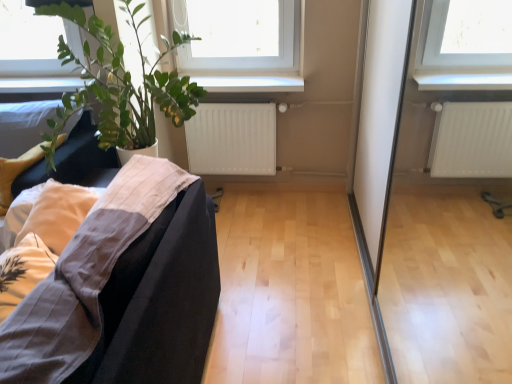
Question: From the image's perspective, does white glossy window sill at upper center appear higher than white matte radiator at center?

Choices:
 (A) yes
 (B) no

Answer: (A)

Question: Is white glossy window sill at upper center to the right of white matte radiator at center from the viewer's perspective?

Choices:
 (A) yes
 (B) no

Answer: (A)

Question: Does white glossy window sill at upper center have a lesser width compared to white matte radiator at center?

Choices:
 (A) no
 (B) yes

Answer: (A)

Question: Are white glossy window sill at upper center and white matte radiator at center beside each other?

Choices:
 (A) yes
 (B) no

Answer: (B)

Question: Is the position of white glossy window sill at upper center less distant than that of white matte radiator at center?

Choices:
 (A) no
 (B) yes

Answer: (B)

Question: Looking at their shapes, would you say transparent glass screen door at lower right is wider or thinner than white matte radiator at center?

Choices:
 (A) thin
 (B) wide

Answer: (A)

Question: Is point (505, 288) positioned closer to the camera than point (230, 163)?

Choices:
 (A) closer
 (B) farther

Answer: (A)

Question: In terms of size, does transparent glass screen door at lower right appear bigger or smaller than white matte radiator at center?

Choices:
 (A) small
 (B) big

Answer: (B)

Question: Considering their positions, is transparent glass screen door at lower right located in front of or behind white matte radiator at center?

Choices:
 (A) behind
 (B) front

Answer: (B)

Question: Is white matte radiator at center situated inside black fabric couch at lower left or outside?

Choices:
 (A) outside
 (B) inside

Answer: (A)

Question: Based on their sizes in the image, would you say white matte radiator at center is bigger or smaller than black fabric couch at lower left?

Choices:
 (A) big
 (B) small

Answer: (B)

Question: Is white matte radiator at center in front of or behind black fabric couch at lower left in the image?

Choices:
 (A) front
 (B) behind

Answer: (B)

Question: From their relative heights in the image, would you say white matte radiator at center is taller or shorter than black fabric couch at lower left?

Choices:
 (A) tall
 (B) short

Answer: (B)

Question: From a real-world perspective, is green leafy plant at left above or below white matte radiator at center?

Choices:
 (A) below
 (B) above

Answer: (B)

Question: Considering the relative positions of green leafy plant at left and white matte radiator at center in the image provided, is green leafy plant at left to the left or to the right of white matte radiator at center?

Choices:
 (A) right
 (B) left

Answer: (B)